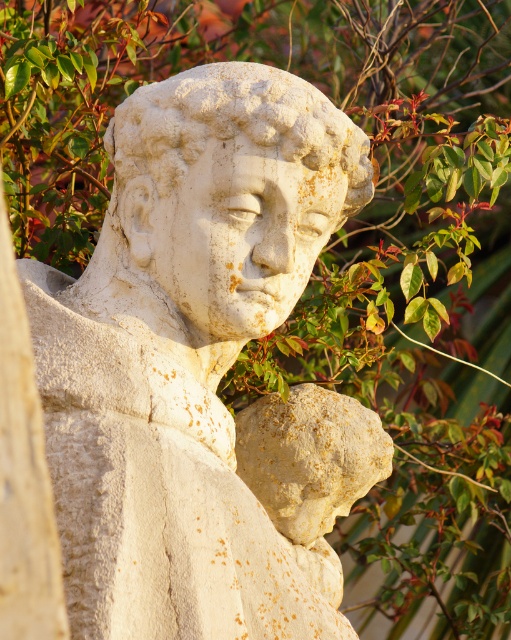
Question: Among these objects, which one is farthest from the camera?

Choices:
 (A) speckled stone head at center
 (B) white stone head at center

Answer: (A)

Question: Which object is positioned farthest from the speckled stone head at center?

Choices:
 (A) white stone head at center
 (B) white stone statue at center

Answer: (B)

Question: Is white stone statue at center positioned before white stone head at center?

Choices:
 (A) no
 (B) yes

Answer: (B)

Question: Does white stone statue at center have a lesser width compared to white stone head at center?

Choices:
 (A) no
 (B) yes

Answer: (A)

Question: Which object appears closest to the camera in this image?

Choices:
 (A) speckled stone head at center
 (B) white stone statue at center
 (C) white stone head at center

Answer: (B)

Question: Can you confirm if white stone statue at center is positioned to the left of speckled stone head at center?

Choices:
 (A) no
 (B) yes

Answer: (B)